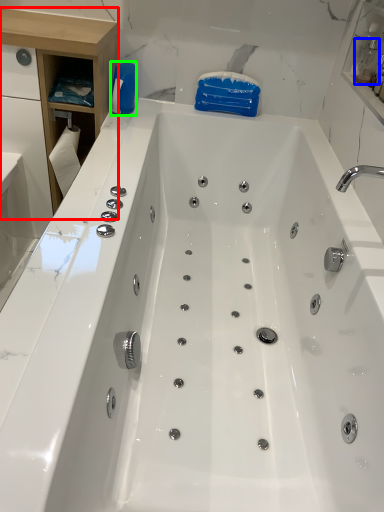
Question: Considering the real-world distances, which object is closest to cabinetry (highlighted by a red box)? bottle (highlighted by a blue box) or cleaning product (highlighted by a green box).

Choices:
 (A) bottle
 (B) cleaning product

Answer: (B)